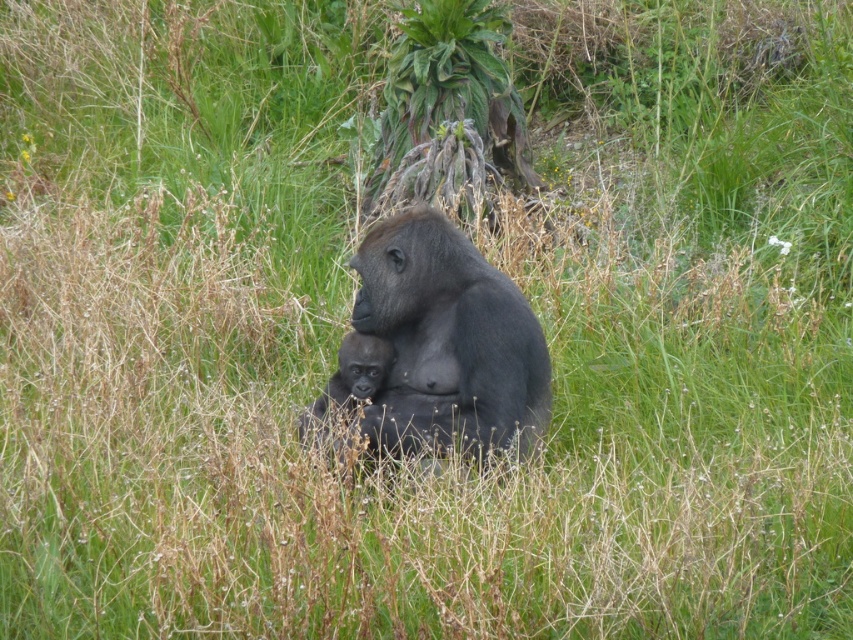
You are a wildlife photographer aiming to capture a closeup shot of both the shiny dark gray gorilla at center and the smooth dark gray baby gorilla at center. Given that your camera can only focus on one subject at a time, which gorilla would you need to adjust the focus settings for to ensure proper focus if you want to switch from the larger one to the smaller one?

Since the shiny dark gray gorilla at center is wider than the smooth dark gray baby gorilla at center, you should adjust the focus settings for the smooth dark gray baby gorilla at center when switching from the larger one to ensure proper focus.